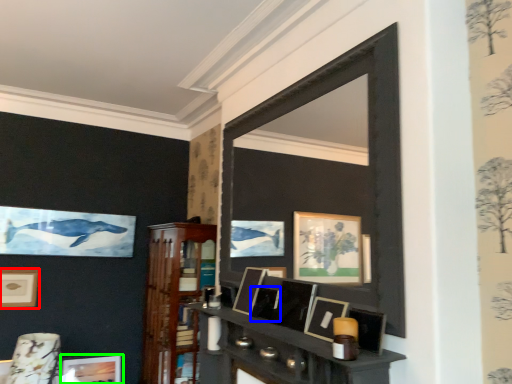
Question: Estimate the real-world distances between objects in this image. Which object is farther from picture frame (highlighted by a red box), picture frame (highlighted by a blue box) or picture frame (highlighted by a green box)?

Choices:
 (A) picture frame
 (B) picture frame

Answer: (A)